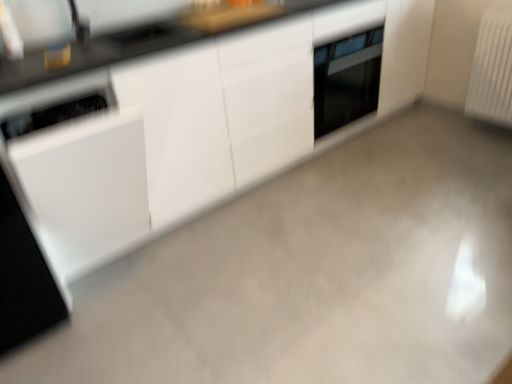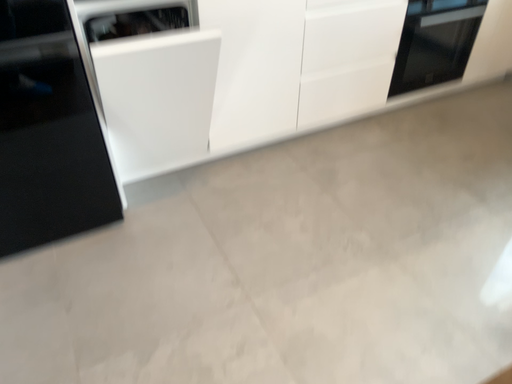
Question: Which way did the camera rotate in the video?

Choices:
 (A) rotated right
 (B) rotated left

Answer: (B)